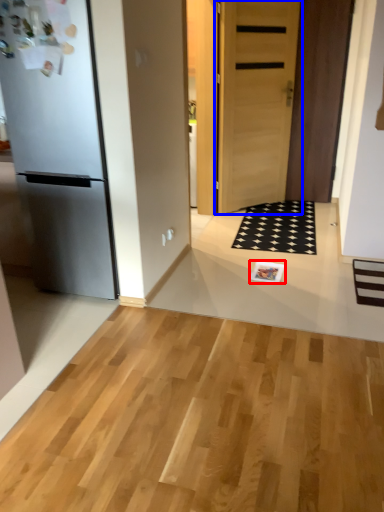
Question: Which of the following is the farthest to the observer, magazine (highlighted by a red box) or door (highlighted by a blue box)?

Choices:
 (A) magazine
 (B) door

Answer: (B)